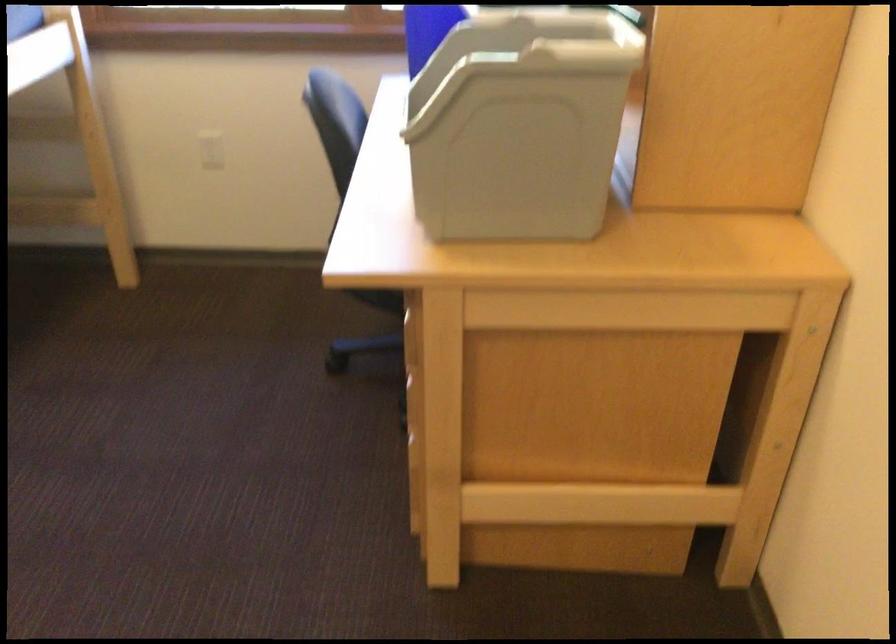
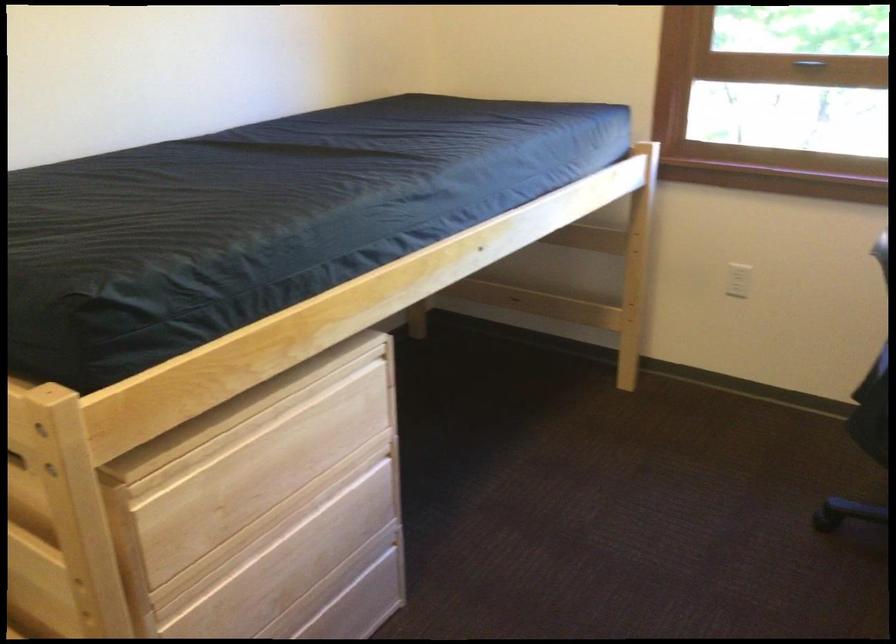
Find the pixel in the second image that matches (x=216, y=154) in the first image.

(738, 279)